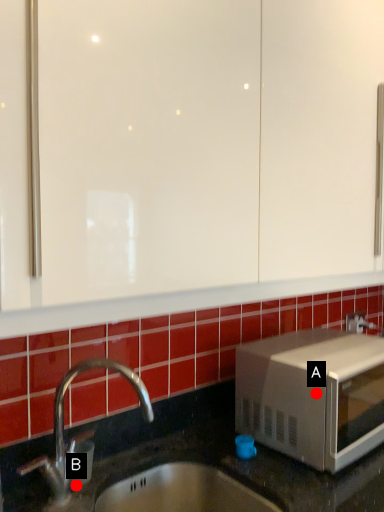
Question: Two points are circled on the image, labeled by A and B beside each circle. Which point appears closest to the camera in this image?

Choices:
 (A) A is closer
 (B) B is closer

Answer: (B)